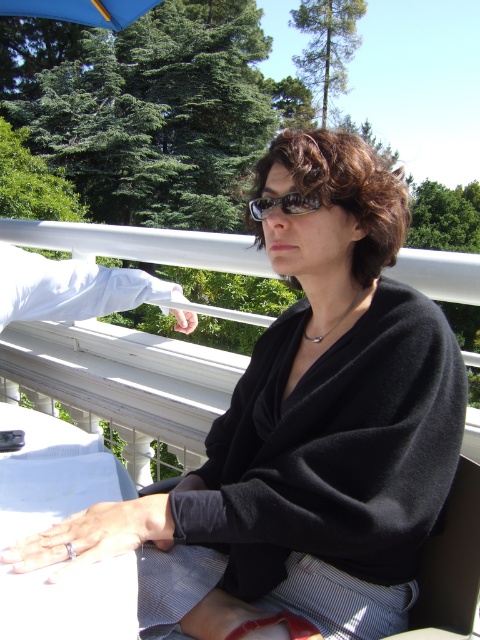
Question: Where is white glossy table at lower left located in relation to brown textured sunglasses at center in the image?

Choices:
 (A) above
 (B) below

Answer: (B)

Question: Can you confirm if white glossy table at lower left is smaller than brown textured sunglasses at center?

Choices:
 (A) no
 (B) yes

Answer: (A)

Question: Which object appears farthest from the camera in this image?

Choices:
 (A) white glossy table at lower left
 (B) brown textured sunglasses at center

Answer: (B)

Question: Among these objects, which one is farthest from the camera?

Choices:
 (A) white glossy table at lower left
 (B) brown textured sunglasses at center

Answer: (B)

Question: Is white glossy table at lower left further to camera compared to brown textured sunglasses at center?

Choices:
 (A) yes
 (B) no

Answer: (B)